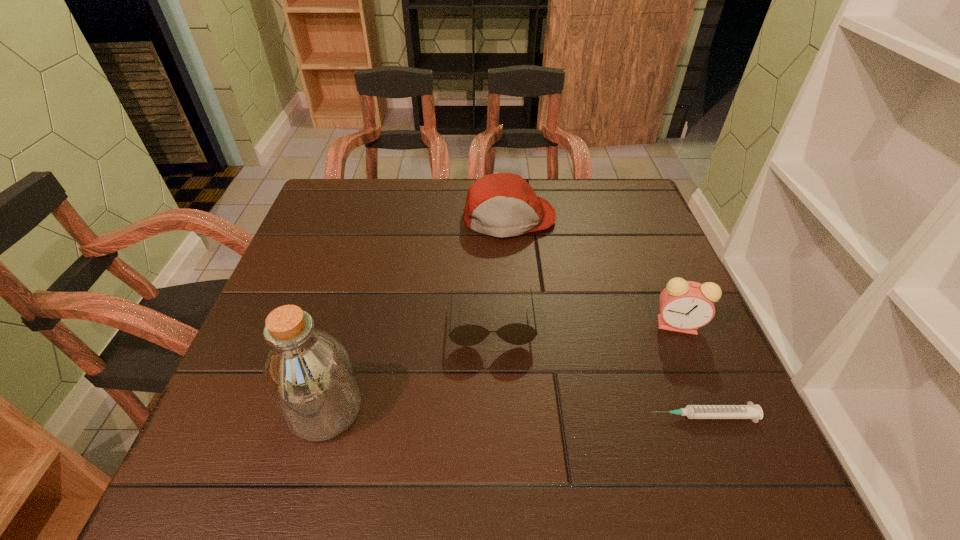
Locate an element on the screen. free space on the desktop that is between the leftmost object and the shortest object and is positioned on the face of the alarm clock is located at coordinates (563, 414).

You are a GUI agent. You are given a task and a screenshot of the screen. Output one action in this format:
    pyautogui.click(x=<x>, y=<y>)
    Task: Click on the vacant spot on the desktop that is between the bottle and the shortest object and is positioned on the front-facing side of the farthest object
    
    Given the screenshot: What is the action you would take?
    pyautogui.click(x=539, y=413)

Image resolution: width=960 pixels, height=540 pixels. I want to click on free space on the desktop that is between the leftmost object and the shortest object and is positioned on the front-facing side of the sunglasses, so click(494, 413).